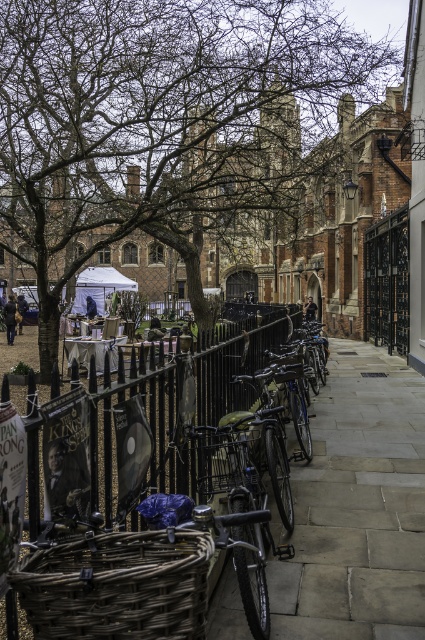
Question: Which of the following is the closest to the observer?

Choices:
 (A) gray stone pavement at center
 (B) brown leafless tree at upper left
 (C) woven brown basket at lower left

Answer: (C)

Question: Which object is closer to the camera taking this photo?

Choices:
 (A) brown leafless tree at upper left
 (B) black metal fence at center
 (C) woven brown basket at lower left

Answer: (C)

Question: Is brown leafless tree at upper left wider than gray stone pavement at center?

Choices:
 (A) yes
 (B) no

Answer: (A)

Question: Does woven brown basket at lower left appear on the left side of black metal fence at center?

Choices:
 (A) no
 (B) yes

Answer: (A)

Question: Considering the real-world distances, which object is farthest from the gray stone pavement at center?

Choices:
 (A) black metal fence at center
 (B) brown leafless tree at upper left
 (C) woven brown basket at lower left

Answer: (B)

Question: Does gray stone pavement at center come behind woven brown basket at lower left?

Choices:
 (A) no
 (B) yes

Answer: (B)